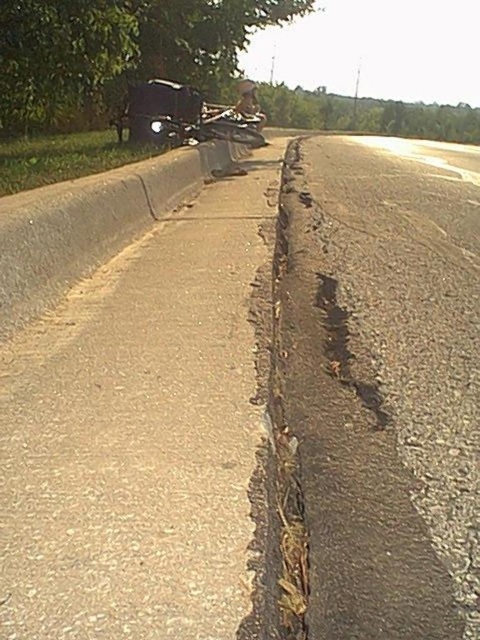
You are a photographer trying to capture the shiny chrome motorcycle at center and the green leafy tree at upper center in the same frame. Which object will appear larger in your photo?

The green leafy tree at upper center will appear larger in the photo because it is bigger than the shiny chrome motorcycle at center.

You are standing at the point marked as point [119,51] on the road. Looking around, you see a green leafy tree at upper center. Can you determine if you are currently under the shade of the green leafy tree at upper center?

The point [119,51] is on the green leafy tree at upper center, so yes, you are currently under the shade of the green leafy tree at upper center.

You are standing at the center of the road and looking towards the green leafy tree at upper center. Which direction should you walk to reach it?

The green leafy tree at upper center is located at point [119,51] in 2D coordinates. Since you are at the center of the road, you should walk towards the upper center direction to reach it.